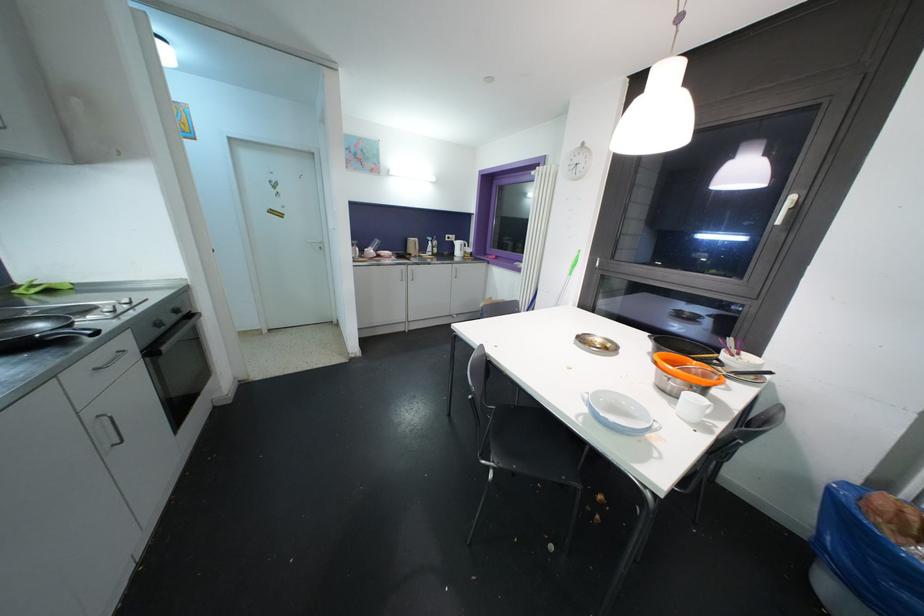
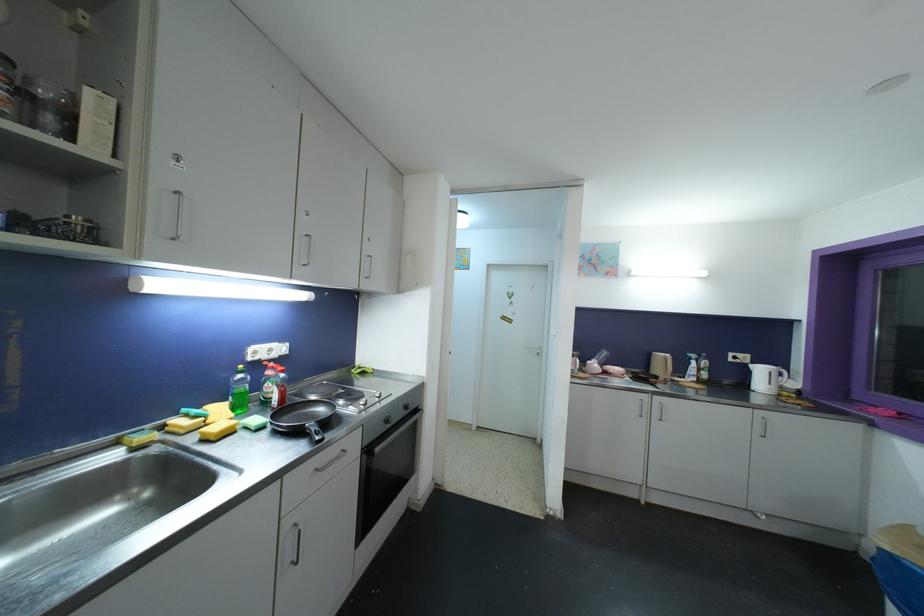
Where in the second image is the point corresponding to the point at 162,328 from the first image?

(390, 424)